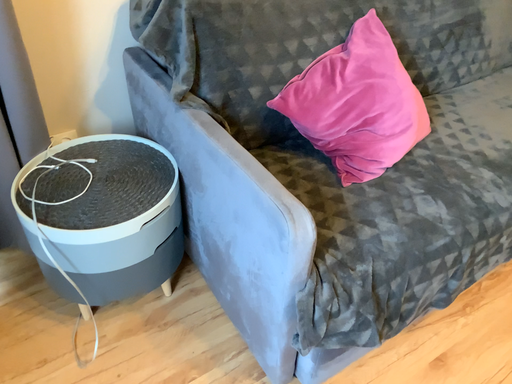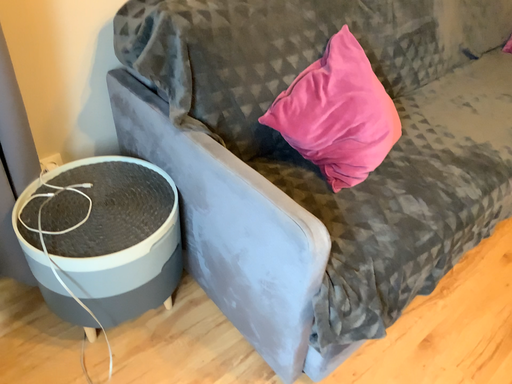
Question: How did the camera likely rotate when shooting the video?

Choices:
 (A) rotated right
 (B) rotated left

Answer: (A)